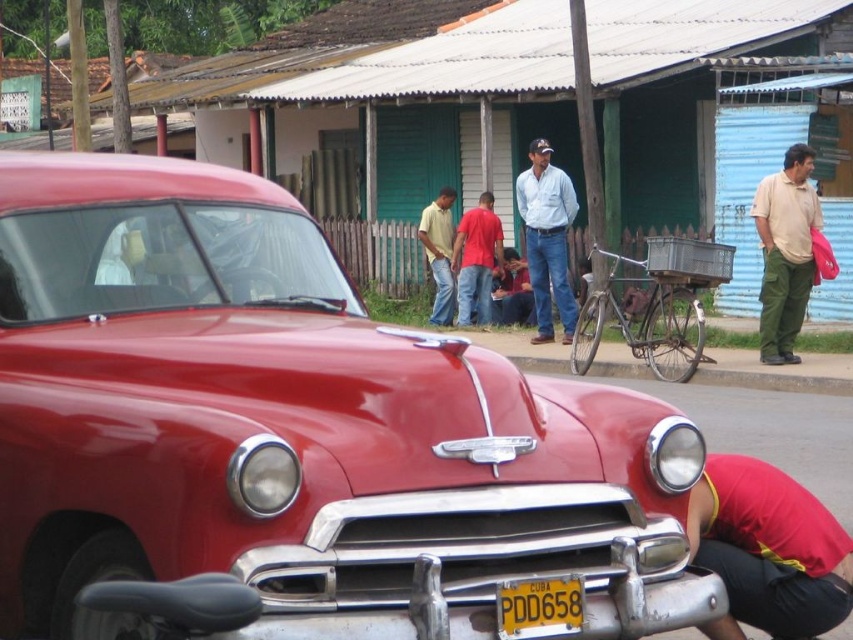
You are a photographer standing in the scene and want to take a picture of the light blue denim shirt at center and the yellow metallic license plate at lower center. Which object should you adjust your camera to focus on first if you want to capture both in the same frame without moving your position?

The light blue denim shirt at center is to the right of the yellow metallic license plate at lower center. Since they are positioned side by side horizontally, you can adjust your camera to focus on either object first as long as your framing includes both in the same shot.

You are standing at point (558, 592) and want to walk to the red car in the foreground. Is the point (527, 227) blocking your path?

Point (527, 227) is behind point (558, 592), so it is not blocking your path to the red car in the foreground.

You are a photographer trying to capture a photo of the red fabric squat at lower right and the matte yellow shirt at center. Which object should you focus on first if you want to include both in the frame without moving the camera?

The red fabric squat at lower right is positioned on the right side of matte yellow shirt at center, so you should focus on the matte yellow shirt at center first to ensure both are in the frame.